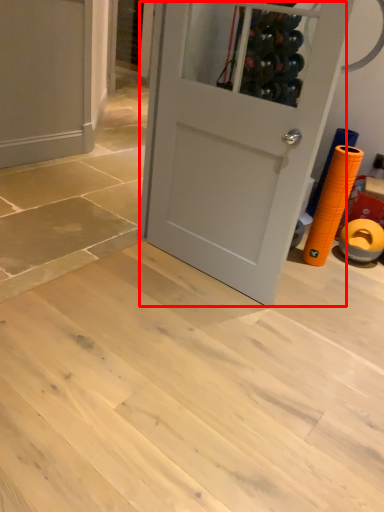
Question: From the image's perspective, what is the correct spatial positioning of door (annotated by the red box) in reference to door?

Choices:
 (A) below
 (B) above

Answer: (A)